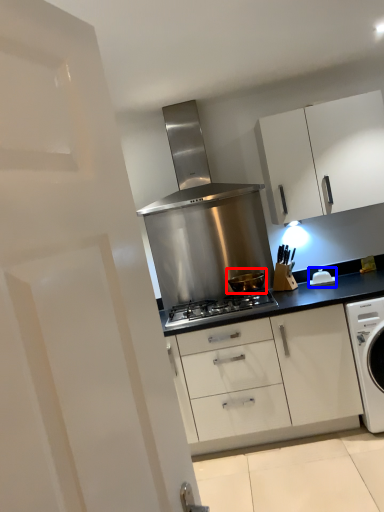
Question: Which of the following is the farthest to the observer, kitchen appliance (highlighted by a red box) or appliance (highlighted by a blue box)?

Choices:
 (A) kitchen appliance
 (B) appliance

Answer: (B)